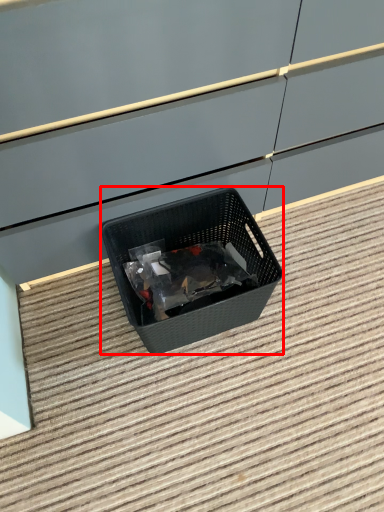
Question: Observing the image, what is the correct spatial positioning of waste container (annotated by the red box) in reference to stair?

Choices:
 (A) left
 (B) right

Answer: (A)